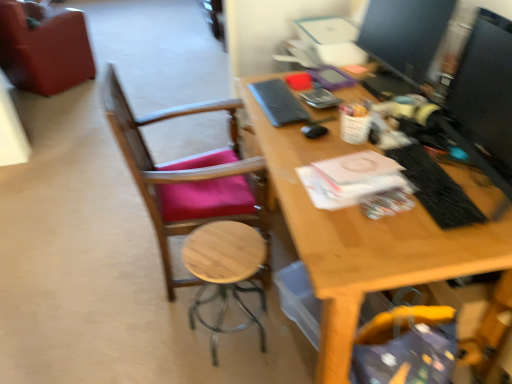
Identify the location of free space to the right of wooden stool at center. Image resolution: width=512 pixels, height=384 pixels. (290, 330).